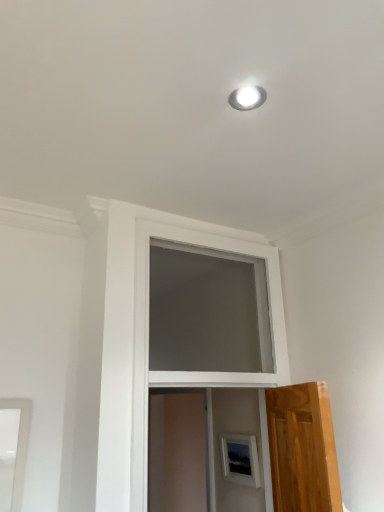
Question: In the image, is white glossy light fixture at upper center positioned in front of or behind translucent wood screen door at center?

Choices:
 (A) front
 (B) behind

Answer: (A)

Question: Which is correct: white glossy light fixture at upper center is inside translucent wood screen door at center, or outside of it?

Choices:
 (A) outside
 (B) inside

Answer: (A)

Question: In terms of size, does white glossy light fixture at upper center appear bigger or smaller than translucent wood screen door at center?

Choices:
 (A) small
 (B) big

Answer: (A)

Question: Is translucent wood screen door at center wider or thinner than white glossy light fixture at upper center?

Choices:
 (A) wide
 (B) thin

Answer: (A)

Question: Relative to white glossy light fixture at upper center, is translucent wood screen door at center in front or behind?

Choices:
 (A) front
 (B) behind

Answer: (B)

Question: Is translucent wood screen door at center spatially inside white glossy light fixture at upper center, or outside of it?

Choices:
 (A) inside
 (B) outside

Answer: (B)

Question: From a real-world perspective, is translucent wood screen door at center physically located above or below white glossy light fixture at upper center?

Choices:
 (A) below
 (B) above

Answer: (A)